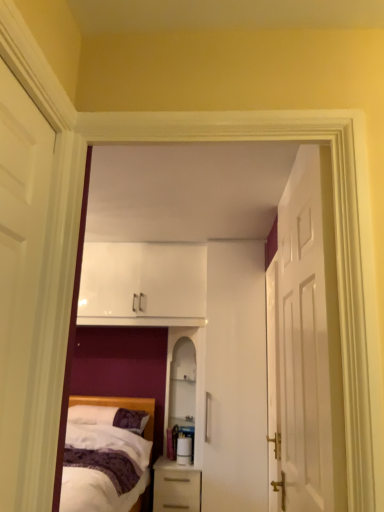
Question: Which is correct: white wooden door at right, which is counted as the second door, starting from the left, is inside white matte door at left, which ranks as the 3th door in right-to-left order, or outside of it?

Choices:
 (A) inside
 (B) outside

Answer: (B)

Question: Considering the positions of white wooden door at right, which is counted as the second door, starting from the left, and white matte door at left, positioned as the 1th door in left-to-right order, in the image, is white wooden door at right, which is counted as the second door, starting from the left, taller or shorter than white matte door at left, positioned as the 1th door in left-to-right order,?

Choices:
 (A) tall
 (B) short

Answer: (A)

Question: Based on their relative distances, which object is farther from the white glossy cabinet at center?

Choices:
 (A) purple soft pillow at lower left
 (B) white glossy nightstand at lower center
 (C) white soft bed at lower left
 (D) white matte door at left, which ranks as the 3th door in right-to-left order
 (E) white wooden door at right, marked as the 2th door in a right-to-left arrangement

Answer: (D)

Question: Based on their relative distances, which object is nearer to the purple soft pillow at lower left?

Choices:
 (A) white glossy door at right, arranged as the 1th door when viewed from the right
 (B) white soft bed at lower left
 (C) white glossy nightstand at lower center
 (D) white wooden door at right, which is counted as the second door, starting from the left
 (E) white matte door at left, which ranks as the 3th door in right-to-left order

Answer: (B)